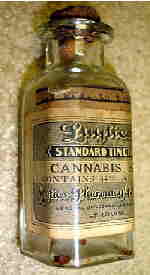
Image resolution: width=150 pixels, height=275 pixels. I want to click on sticker, so click(x=113, y=113).